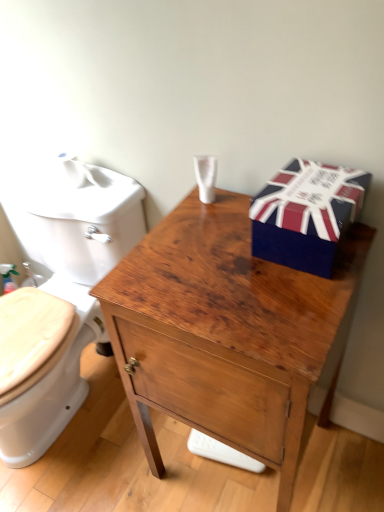
This screenshot has height=512, width=384. I want to click on vacant area on top of wooden cabinet at center (from a real-world perspective), so click(225, 263).